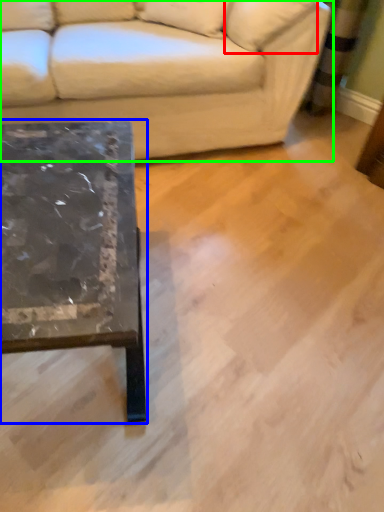
Question: Estimate the real-world distances between objects in this image. Which object is farther from pillow (highlighted by a red box), coffee table (highlighted by a blue box) or studio couch (highlighted by a green box)?

Choices:
 (A) coffee table
 (B) studio couch

Answer: (A)